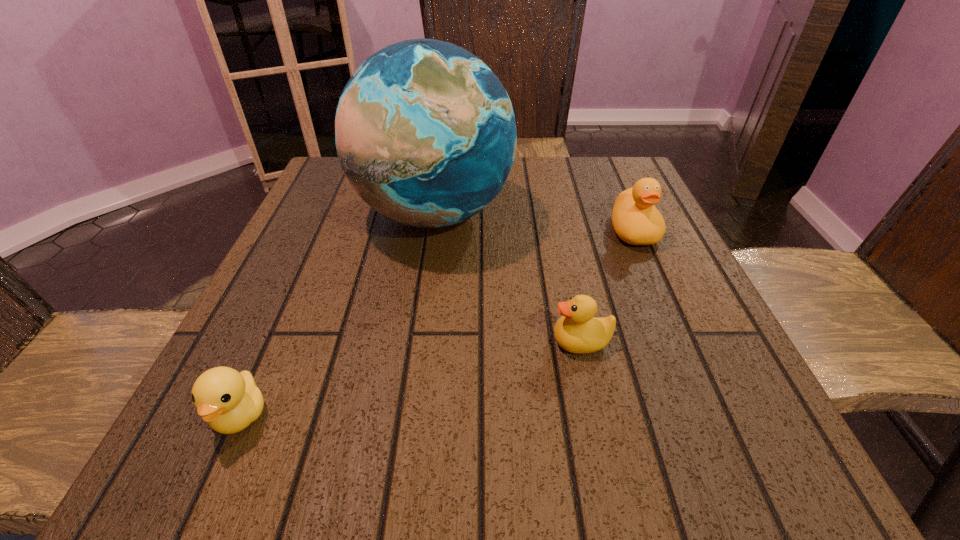
The height and width of the screenshot is (540, 960). I want to click on vacant area that satisfies the following two spatial constraints: 1. at the beak of the second nearest object; 2. on the face of the leftmost duck, so click(x=597, y=415).

Where is `vacant space that satisfies the following two spatial constraints: 1. on the face of the rightmost object; 2. at the beak of the second duck from left to right`? vacant space that satisfies the following two spatial constraints: 1. on the face of the rightmost object; 2. at the beak of the second duck from left to right is located at coordinates [x=682, y=341].